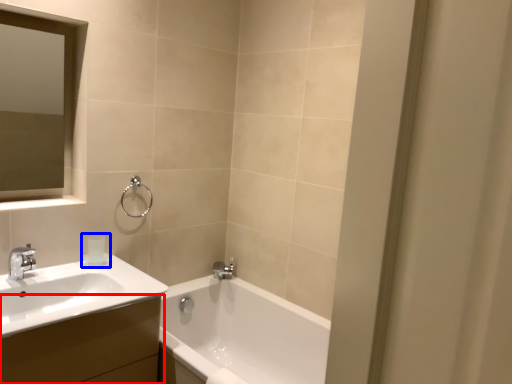
Question: Which object appears farthest to the camera in this image, bathroom cabinet (highlighted by a red box) or toiletry (highlighted by a blue box)?

Choices:
 (A) bathroom cabinet
 (B) toiletry

Answer: (B)